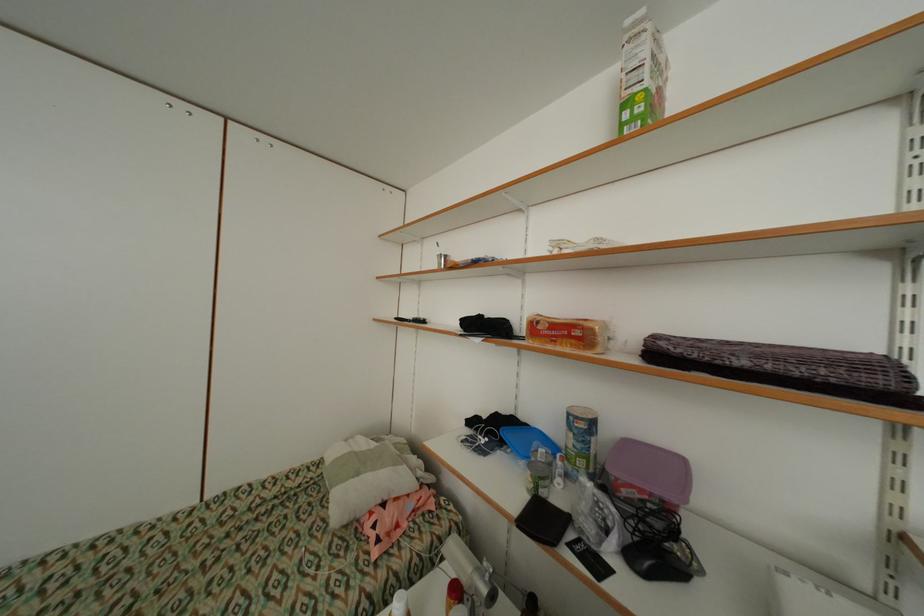
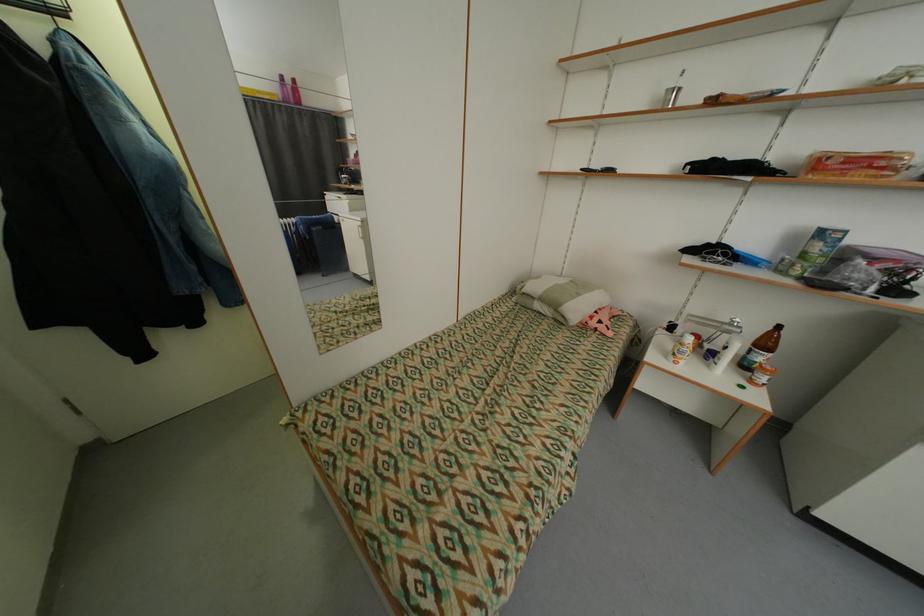
Locate, in the second image, the point that corresponds to point 489,578 in the first image.

(736, 326)